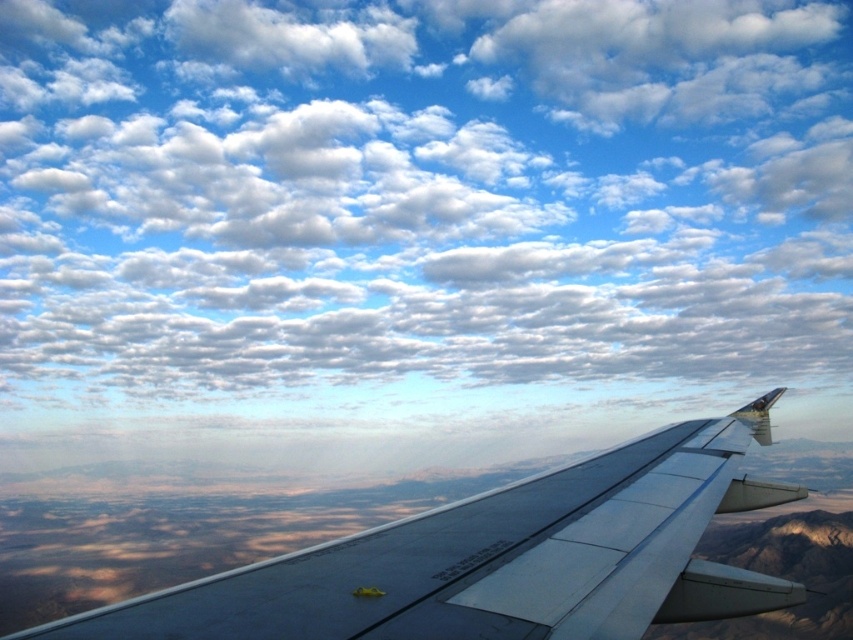
You are a pilot flying at an altitude of 10,000 feet and looking out the window of the airplane. You notice the white fluffy cloud at upper center. Can you determine if the cloud is within your current altitude?

The white fluffy cloud at upper center is 583.74 feet from the camera, which is much lower than the airplane flying at 10,000 feet. Therefore, the white fluffy cloud at upper center is below the airplane and within the current altitude.

Looking at this image, you are a passenger sitting in the airplane and looking out the window. You see two points marked on the wing at point coordinates point (494, 35) and point (498, 634). Which point is closer to you?

Point (494, 35) is further to the viewer than point (498, 634), so the point closer to you is point (498, 634).

You are a pilot checking the aircraft wing for potential cloud collisions. Based on the scene, which object is taller, the white fluffy cloud at upper center or the metallic gray wing at center?

The white fluffy cloud at upper center is much taller than the metallic gray wing at center, so there might be a collision risk.